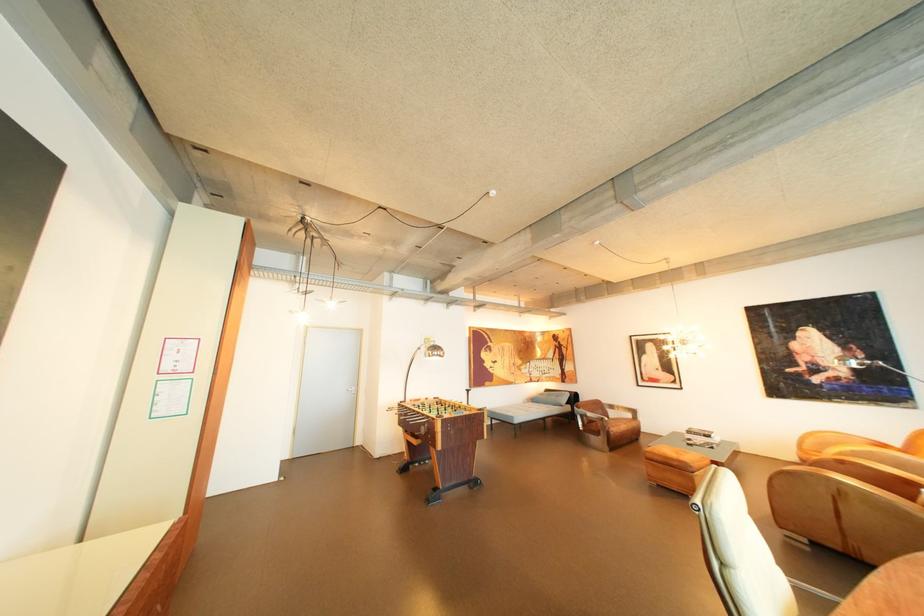
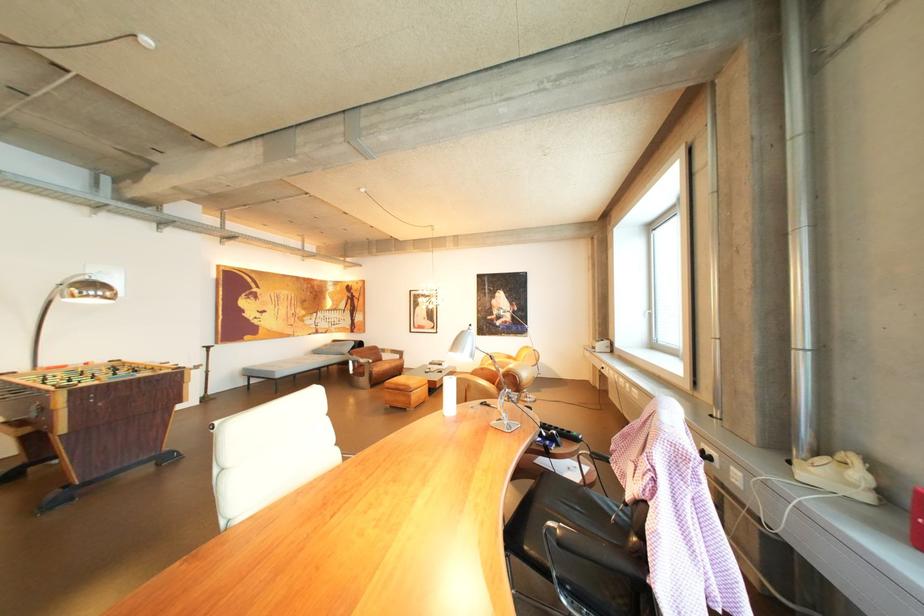
Find the pixel in the second image that matches pixel 450 354 in the first image.

(105, 294)